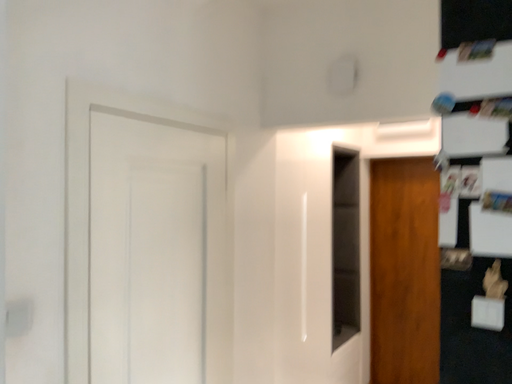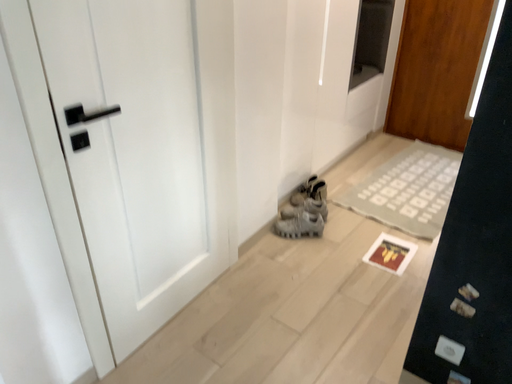
Question: Which way did the camera rotate in the video?

Choices:
 (A) rotated upward
 (B) rotated downward

Answer: (B)